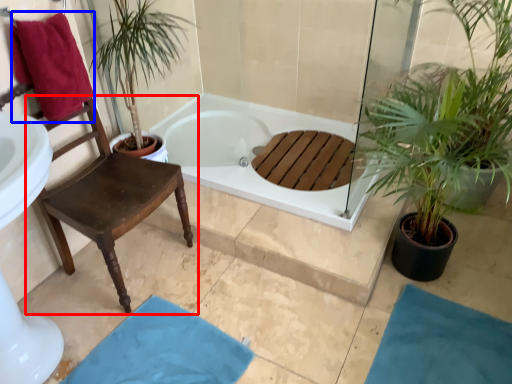
Question: Which point is closer to the camera, chair (highlighted by a red box) or beach towel (highlighted by a blue box)?

Choices:
 (A) chair
 (B) beach towel

Answer: (A)